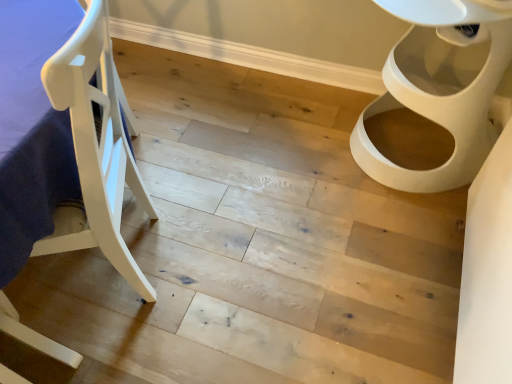
Question: From the image's perspective, is white wood chair at left beneath white glossy toilet at right?

Choices:
 (A) yes
 (B) no

Answer: (A)

Question: From a real-world perspective, does white wood chair at left stand above white glossy toilet at right?

Choices:
 (A) no
 (B) yes

Answer: (B)

Question: Considering the relative sizes of white wood chair at left and white glossy toilet at right in the image provided, is white wood chair at left bigger than white glossy toilet at right?

Choices:
 (A) no
 (B) yes

Answer: (B)

Question: From a real-world perspective, is white wood chair at left under white glossy toilet at right?

Choices:
 (A) yes
 (B) no

Answer: (B)

Question: Is the position of white wood chair at left less distant than that of white glossy toilet at right?

Choices:
 (A) no
 (B) yes

Answer: (B)

Question: Is white wood chair at left positioned far away from white glossy toilet at right?

Choices:
 (A) yes
 (B) no

Answer: (A)

Question: Is white glossy toilet at right outside of white wood chair at left?

Choices:
 (A) yes
 (B) no

Answer: (A)

Question: Is white glossy toilet at right at the right side of white wood chair at left?

Choices:
 (A) no
 (B) yes

Answer: (B)

Question: Is white glossy toilet at right far from white wood chair at left?

Choices:
 (A) yes
 (B) no

Answer: (A)

Question: Are white glossy toilet at right and white wood chair at left making contact?

Choices:
 (A) no
 (B) yes

Answer: (A)

Question: Does white glossy toilet at right come behind white wood chair at left?

Choices:
 (A) yes
 (B) no

Answer: (A)

Question: Is white glossy toilet at right facing away from white wood chair at left?

Choices:
 (A) yes
 (B) no

Answer: (B)

Question: Is white glossy toilet at right in front of or behind white wood chair at left in the image?

Choices:
 (A) behind
 (B) front

Answer: (A)